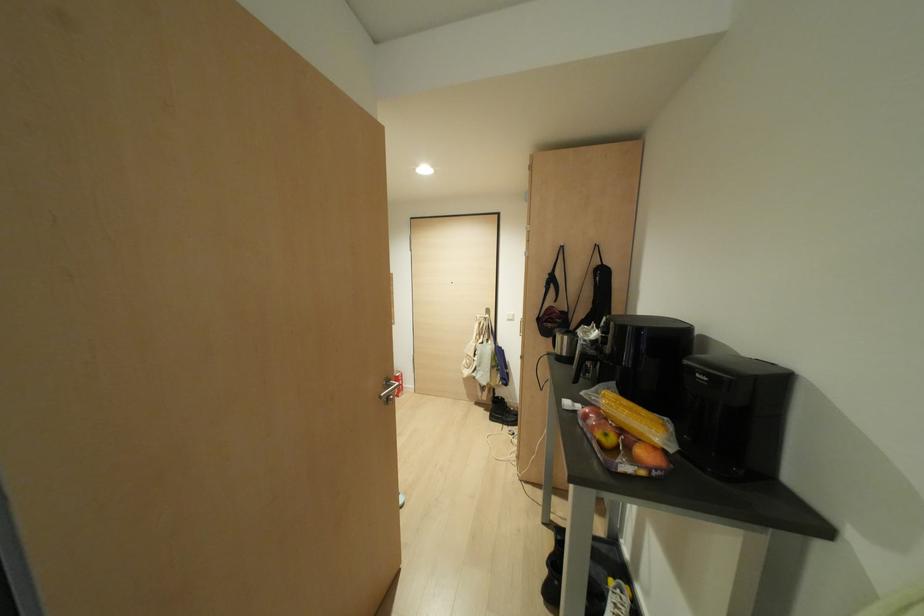
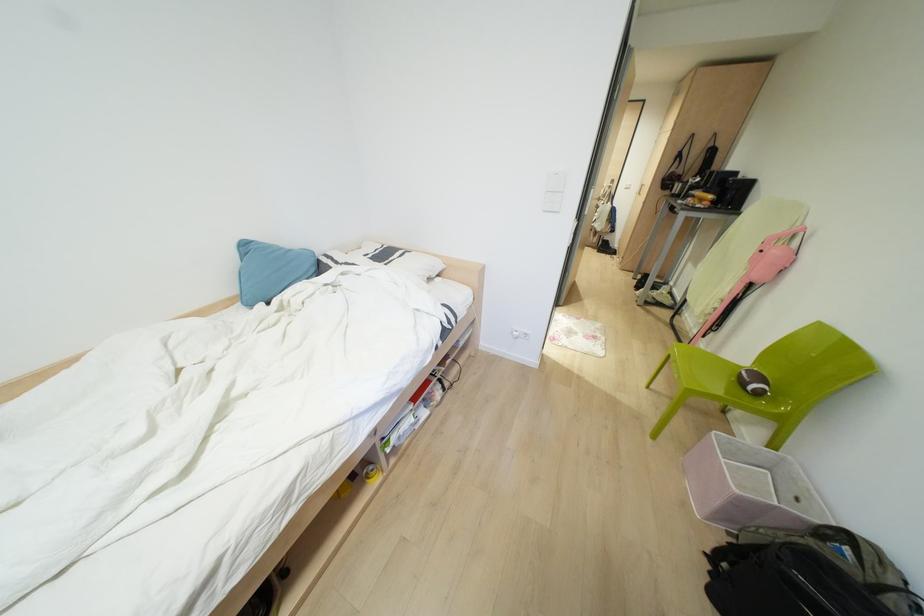
From the picture: The images are taken continuously from a first-person perspective. In which direction are you moving?

The cameraman moved toward left, backward.